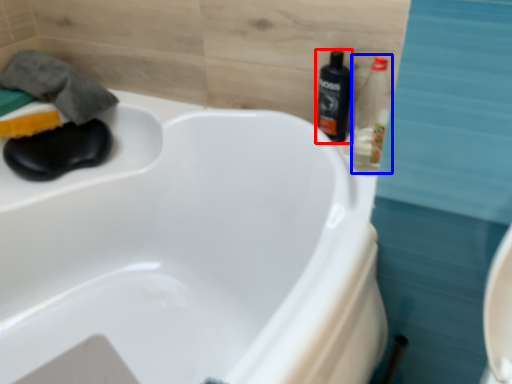
Question: Which point is further to the camera, bottle (highlighted by a red box) or bottle (highlighted by a blue box)?

Choices:
 (A) bottle
 (B) bottle

Answer: (A)